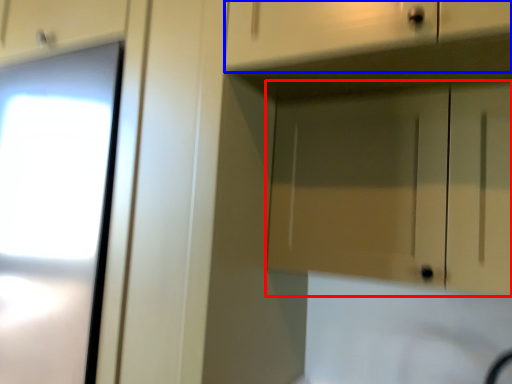
Question: Which object is closer to the camera taking this photo, cabinetry (highlighted by a red box) or drawer (highlighted by a blue box)?

Choices:
 (A) cabinetry
 (B) drawer

Answer: (B)